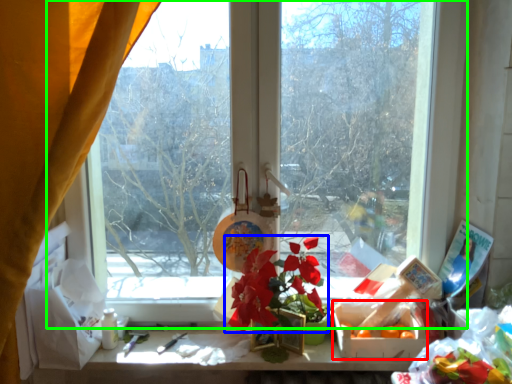
Question: Which object is positioned farthest from flower box (highlighted by a red box)? Select from flower (highlighted by a blue box) and window (highlighted by a green box).

Choices:
 (A) flower
 (B) window

Answer: (B)